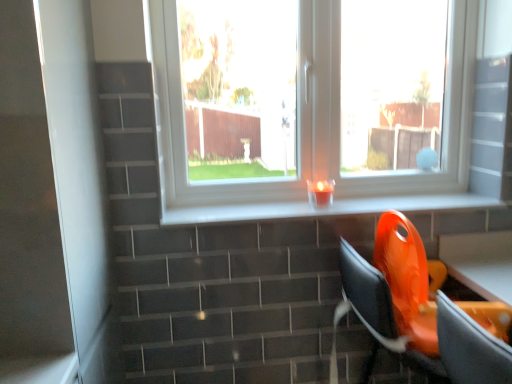
Question: Is orange plastic chair at lower right in front of or behind orange plastic swivel chair at lower right in the image?

Choices:
 (A) behind
 (B) front

Answer: (B)

Question: From their relative heights in the image, would you say orange plastic chair at lower right is taller or shorter than orange plastic swivel chair at lower right?

Choices:
 (A) short
 (B) tall

Answer: (A)

Question: Which object is the closest to the orange plastic swivel chair at lower right?

Choices:
 (A) translucent glass candle at center
 (B) transparent glass window at center
 (C) orange plastic chair at lower right
 (D) white glossy screen door at left
 (E) white glossy window sill at center

Answer: (C)

Question: Considering the real-world distances, which object is farthest from the orange plastic swivel chair at lower right?

Choices:
 (A) translucent glass candle at center
 (B) white glossy screen door at left
 (C) orange plastic chair at lower right
 (D) transparent glass window at center
 (E) white glossy window sill at center

Answer: (B)